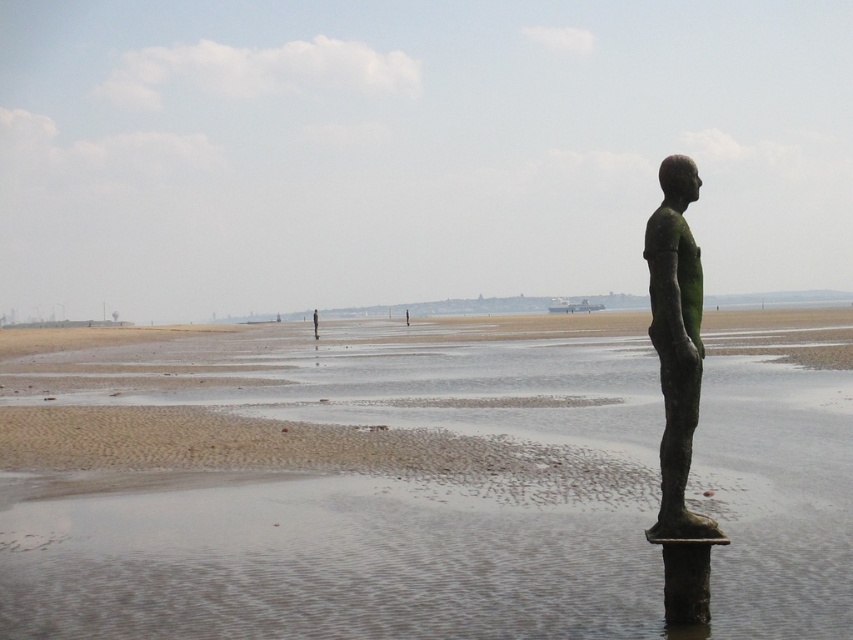
You are a tourist standing on the sandy brown beach at center and want to take a photo of the green patina bronze statue at right. If your camera has a maximum focus range of 20 meters, will you be able to capture the statue clearly in your photo?

The sandy brown beach at center and green patina bronze statue at right are 20.88 meters apart from each other. Since the distance exceeds the camera maximum focus range of 20 meters, you will not be able to capture the statue clearly in your photo.

What is the color of the beach at the point marked by coordinates (335, 484)?

The sandy brown beach at center is marked by the point (335, 484), so the color is sandy brown.